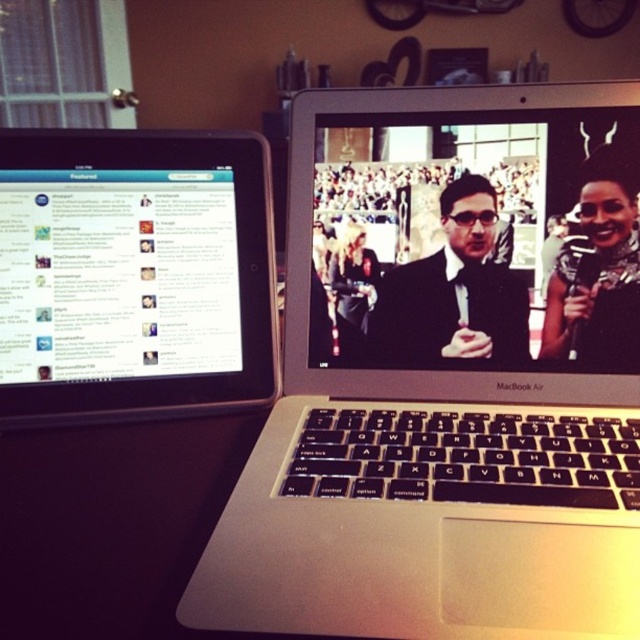
Question: Observing the image, what is the correct spatial positioning of satin black laptop at center in reference to black suit at center?

Choices:
 (A) below
 (B) above

Answer: (B)

Question: Is satin black laptop at center positioned at the back of black suit at center?

Choices:
 (A) yes
 (B) no

Answer: (B)

Question: Is silver metallic laptop at center to the right of satin black laptop at center from the viewer's perspective?

Choices:
 (A) no
 (B) yes

Answer: (A)

Question: Which of the following is the farthest from the observer?

Choices:
 (A) (548, 305)
 (B) (408, 266)

Answer: (B)

Question: Which point appears farthest from the camera in this image?

Choices:
 (A) (493, 317)
 (B) (209, 362)

Answer: (B)

Question: Which point is closer to the camera taking this photo?

Choices:
 (A) (1, 416)
 (B) (609, 273)

Answer: (A)